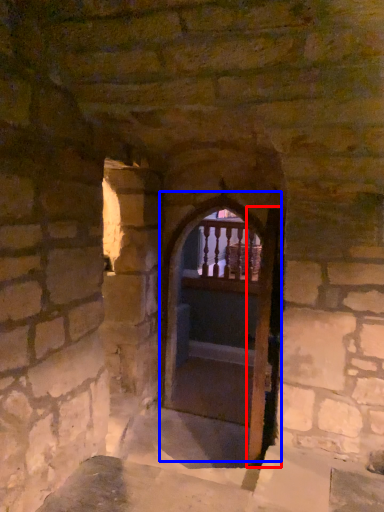
Question: Among these objects, which one is nearest to the camera, screen door (highlighted by a red box) or door (highlighted by a blue box)?

Choices:
 (A) screen door
 (B) door

Answer: (A)